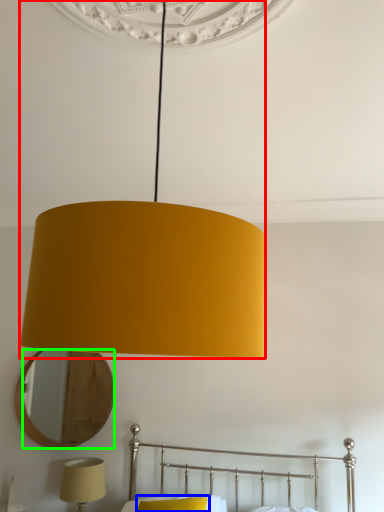
Question: Estimate the real-world distances between objects in this image. Which object is farther from lamp (highlighted by a red box), pillow (highlighted by a blue box) or mirror (highlighted by a green box)?

Choices:
 (A) pillow
 (B) mirror

Answer: (B)